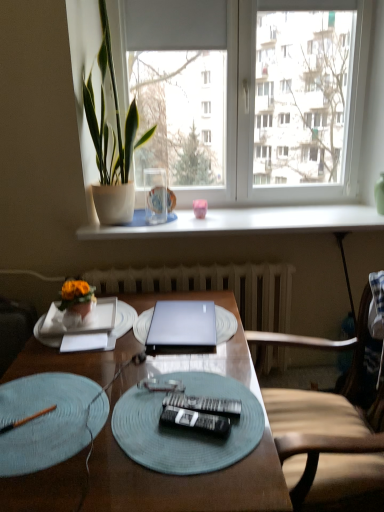
Question: Does black plastic remote control at center, which ranks as the second remote control in front-to-back order, contain pink matte coffee cup at center?

Choices:
 (A) yes
 (B) no

Answer: (B)

Question: From a real-world perspective, is black plastic remote control at center, which ranks as the second remote control in front-to-back order, located beneath pink matte coffee cup at center?

Choices:
 (A) yes
 (B) no

Answer: (A)

Question: Could you tell me if black plastic remote control at center, which is counted as the first remote control, starting from the back, is turned towards pink matte coffee cup at center?

Choices:
 (A) no
 (B) yes

Answer: (A)

Question: Considering the relative positions of black plastic remote control at center, which is counted as the first remote control, starting from the back, and pink matte coffee cup at center in the image provided, is black plastic remote control at center, which is counted as the first remote control, starting from the back, to the left of pink matte coffee cup at center from the viewer's perspective?

Choices:
 (A) yes
 (B) no

Answer: (A)

Question: From a real-world perspective, is black plastic remote control at center, which is counted as the first remote control, starting from the back, physically above pink matte coffee cup at center?

Choices:
 (A) no
 (B) yes

Answer: (A)

Question: Is point (153, 331) closer or farther from the camera than point (104, 345)?

Choices:
 (A) closer
 (B) farther

Answer: (B)

Question: From a real-world perspective, is silver metallic laptop at center positioned above or below white paper at center?

Choices:
 (A) above
 (B) below

Answer: (A)

Question: Is silver metallic laptop at center spatially inside white paper at center, or outside of it?

Choices:
 (A) inside
 (B) outside

Answer: (B)

Question: In terms of height, does silver metallic laptop at center look taller or shorter compared to white paper at center?

Choices:
 (A) short
 (B) tall

Answer: (B)

Question: Looking at the image, does black plastic remote control at center, which is counted as the first remote control, starting from the back, seem bigger or smaller compared to pink matte coffee cup at center?

Choices:
 (A) small
 (B) big

Answer: (A)

Question: From the image's perspective, relative to pink matte coffee cup at center, is black plastic remote control at center, which ranks as the second remote control in front-to-back order, above or below?

Choices:
 (A) below
 (B) above

Answer: (A)

Question: Is black plastic remote control at center, which ranks as the second remote control in front-to-back order, in front of or behind pink matte coffee cup at center in the image?

Choices:
 (A) front
 (B) behind

Answer: (A)

Question: From a real-world perspective, is black plastic remote control at center, which is counted as the first remote control, starting from the back, physically located above or below pink matte coffee cup at center?

Choices:
 (A) below
 (B) above

Answer: (A)

Question: Relative to green leafy plant at left, is wooden at right in front or behind?

Choices:
 (A) front
 (B) behind

Answer: (A)

Question: Would you say wooden at right is to the left or to the right of green leafy plant at left in the picture?

Choices:
 (A) left
 (B) right

Answer: (B)